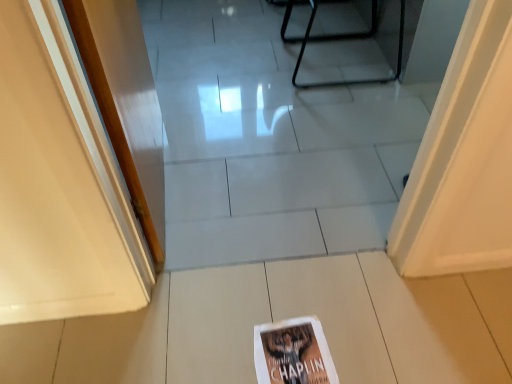
Describe the element at coordinates (293, 353) in the screenshot. The width and height of the screenshot is (512, 384). I see `white paper book at center` at that location.

The width and height of the screenshot is (512, 384). I want to click on white paper book at center, so click(x=293, y=353).

Where is `white paper book at center`? This screenshot has width=512, height=384. white paper book at center is located at coordinates (293, 353).